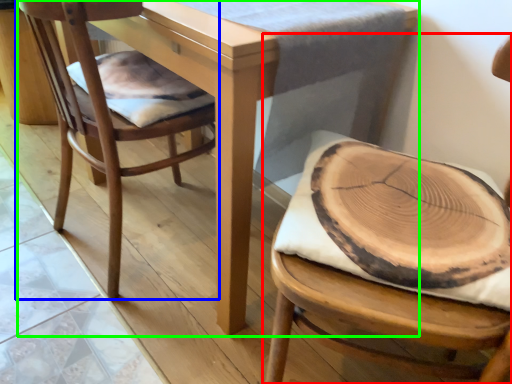
Question: Considering the real-world distances, which object is farthest from chair (highlighted by a red box)? chair (highlighted by a blue box) or table (highlighted by a green box)?

Choices:
 (A) chair
 (B) table

Answer: (A)